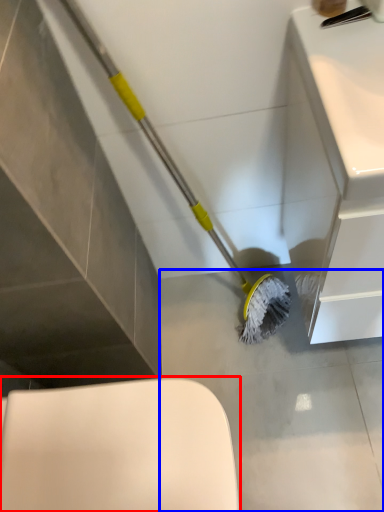
Question: Which of the following is the farthest to the observer, toilet (highlighted by a red box) or concrete (highlighted by a blue box)?

Choices:
 (A) toilet
 (B) concrete

Answer: (B)